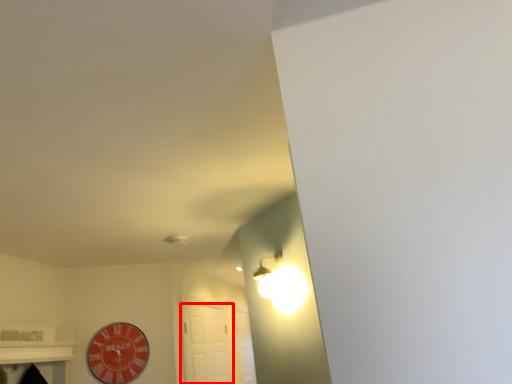
Question: Observing the image, what is the correct spatial positioning of door (annotated by the red box) in reference to wall clock?

Choices:
 (A) left
 (B) right

Answer: (B)